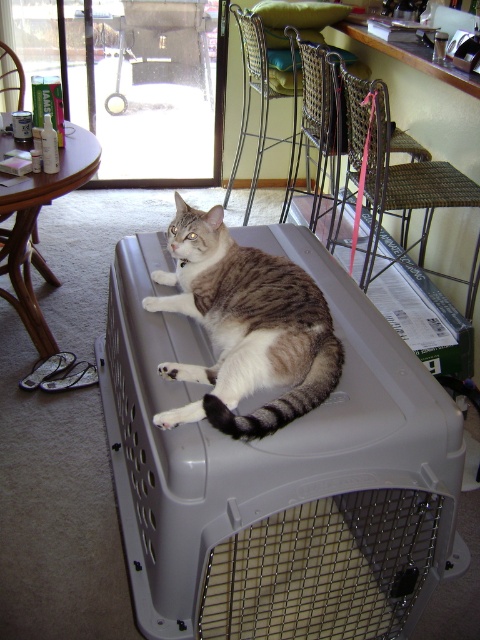
Question: Which point appears farthest from the camera in this image?

Choices:
 (A) (294, 115)
 (B) (428, 188)

Answer: (A)

Question: Can you confirm if woven wicker chair at center is bigger than woven metal chair at upper center?

Choices:
 (A) yes
 (B) no

Answer: (B)

Question: Can you confirm if woven wicker chair at center is positioned to the right of woven metal chair at upper center?

Choices:
 (A) no
 (B) yes

Answer: (B)

Question: Which of the following is the closest to the observer?

Choices:
 (A) tabby fur cat at center
 (B) woven metal chair at upper center
 (C) gray plastic crate at center

Answer: (C)

Question: Does gray plastic crate at center come in front of woven wicker chair at center?

Choices:
 (A) no
 (B) yes

Answer: (B)

Question: Which point is closer to the camera?

Choices:
 (A) tabby fur cat at center
 (B) metallic wire chair at upper center
 (C) gray plastic crate at center

Answer: (C)